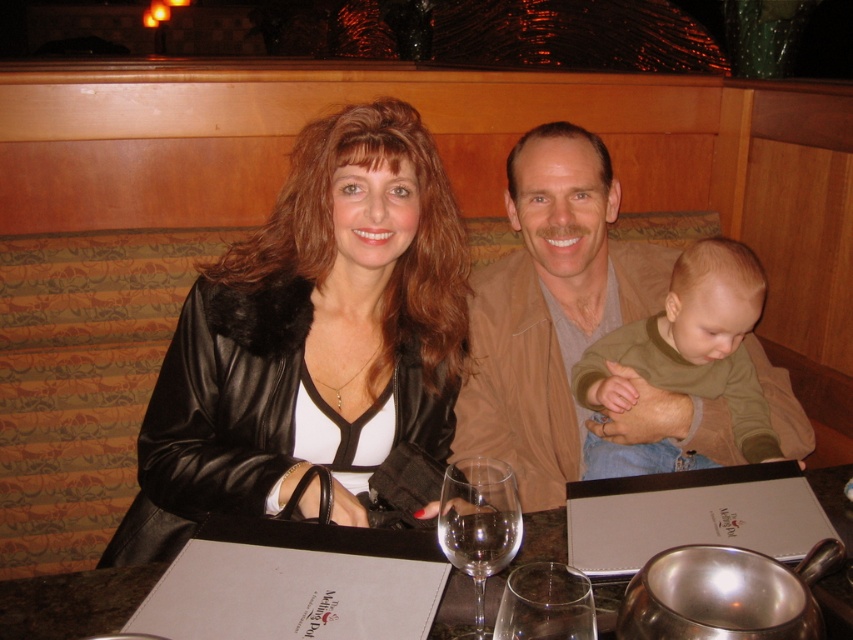
Question: Is tan leather jacket at center in front of transparent glass at center?

Choices:
 (A) no
 (B) yes

Answer: (A)

Question: Does black leather jacket at center have a smaller size compared to tan leather jacket at center?

Choices:
 (A) yes
 (B) no

Answer: (B)

Question: Which point appears closest to the camera in this image?

Choices:
 (A) (508, 492)
 (B) (561, 636)
 (C) (459, 632)

Answer: (B)

Question: Which object appears closest to the camera in this image?

Choices:
 (A) tan leather jacket at center
 (B) matte white menu at center

Answer: (B)

Question: Estimate the real-world distances between objects in this image. Which object is farther from the transparent glass at table center?

Choices:
 (A) green cotton shirt at center
 (B) transparent glass at center

Answer: (A)

Question: Can you confirm if tan leather jacket at center is positioned below transparent glass at table center?

Choices:
 (A) no
 (B) yes

Answer: (A)